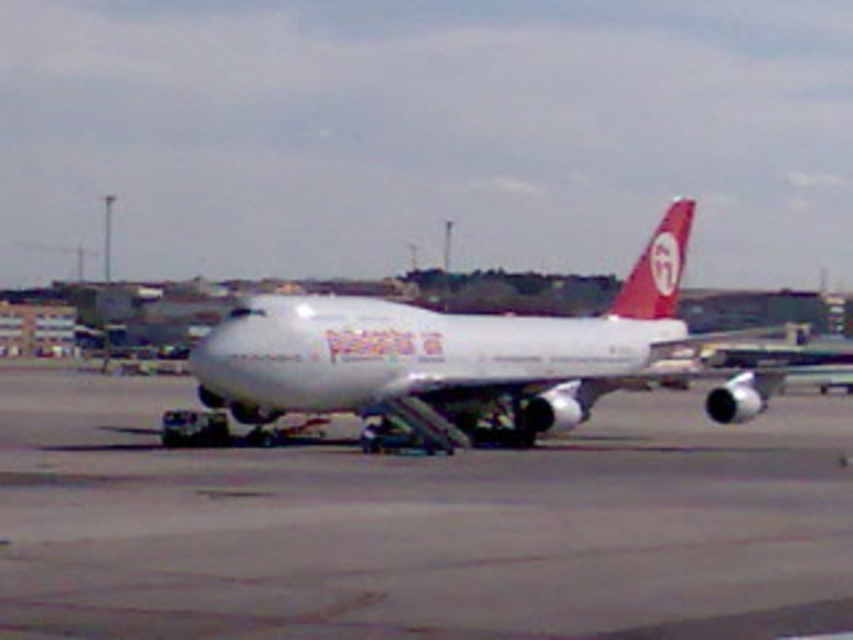
Can you confirm if white glossy airliner at center is smaller than matte red airplane tail at upper right?

Yes, white glossy airliner at center is smaller than matte red airplane tail at upper right.

Can you confirm if white glossy airliner at center is wider than matte red airplane tail at upper right?

In fact, white glossy airliner at center might be narrower than matte red airplane tail at upper right.

Where is `white glossy airliner at center`? The width and height of the screenshot is (853, 640). white glossy airliner at center is located at coordinates (440, 353).

Who is shorter, gray concrete runway at center or matte red airplane tail at upper right?

gray concrete runway at center

Can you confirm if gray concrete runway at center is shorter than matte red airplane tail at upper right?

Yes, gray concrete runway at center is shorter than matte red airplane tail at upper right.

The width and height of the screenshot is (853, 640). What do you see at coordinates (421, 525) in the screenshot?
I see `gray concrete runway at center` at bounding box center [421, 525].

I want to click on gray concrete runway at center, so pos(421,525).

Can you confirm if gray concrete runway at center is positioned above white glossy airliner at center?

No, gray concrete runway at center is not above white glossy airliner at center.

Between point (236, 458) and point (328, 397), which one is positioned in front?

Point (236, 458) is in front.

Between point (740, 465) and point (659, 227), which one is positioned behind?

The point (659, 227) is more distant.

Find the location of a particular element. The height and width of the screenshot is (640, 853). gray concrete runway at center is located at coordinates (421, 525).